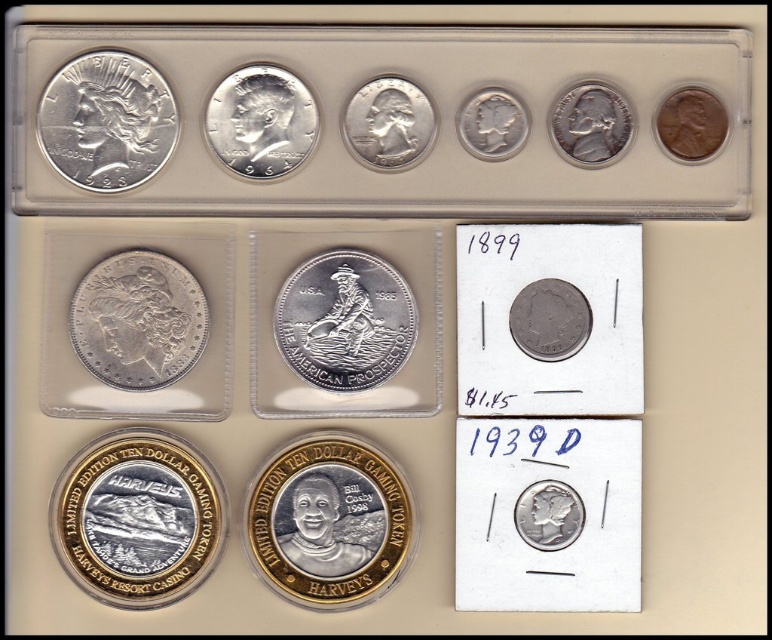
Which is above, gold plated coin at center or brown copper penny at upper right?

brown copper penny at upper right is higher up.

Consider the image. Does gold plated coin at center lie in front of brown copper penny at upper right?

Yes, it is.

Does point (357, 468) come closer to viewer compared to point (723, 131)?

Yes, it is in front of point (723, 131).

The height and width of the screenshot is (640, 772). I want to click on gold plated coin at center, so click(329, 522).

Between silver/smooth/coin at upper left and brown copper penny at upper right, which one appears on the right side from the viewer's perspective?

Positioned to the right is brown copper penny at upper right.

Can you confirm if silver/smooth/coin at upper left is taller than brown copper penny at upper right?

Yes, silver/smooth/coin at upper left is taller than brown copper penny at upper right.

Is point (180, 356) less distant than point (672, 93)?

Yes, it is.

The height and width of the screenshot is (640, 772). In order to click on silver/smooth/coin at upper left in this screenshot , I will do `click(137, 321)`.

Does satin silver coin at upper center appear on the right side of satin silver coin at center?

No, satin silver coin at upper center is not to the right of satin silver coin at center.

Between point (307, 88) and point (388, 161), which one is positioned behind?

The point (388, 161) is more distant.

Find the location of a particular element. satin silver coin at upper center is located at coordinates (261, 122).